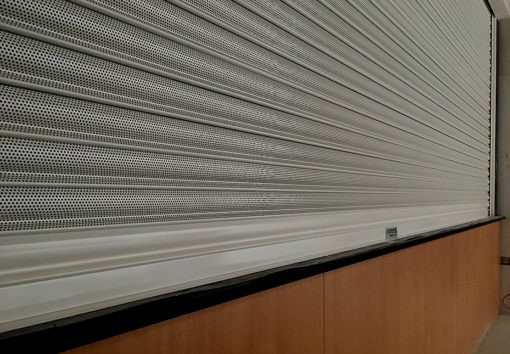
Locate an element on the screen. ceiling is located at coordinates (506, 4).